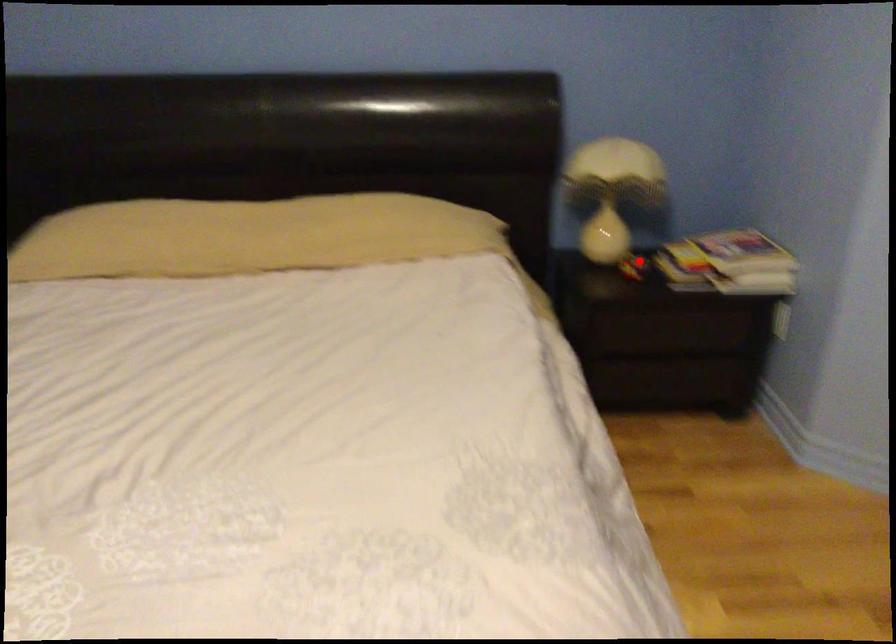
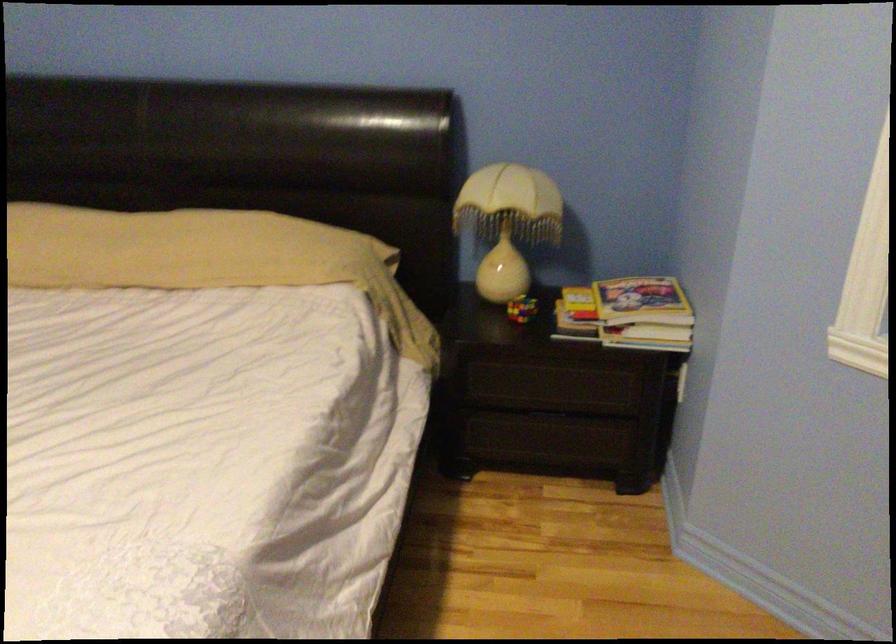
The point at the highlighted location is marked in the first image. Where is the corresponding point in the second image?

(521, 308)